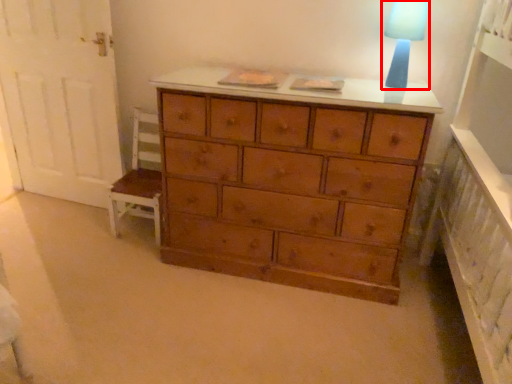
Question: Observing the image, what is the correct spatial positioning of lamp (annotated by the red box) in reference to armchair?

Choices:
 (A) left
 (B) right

Answer: (B)